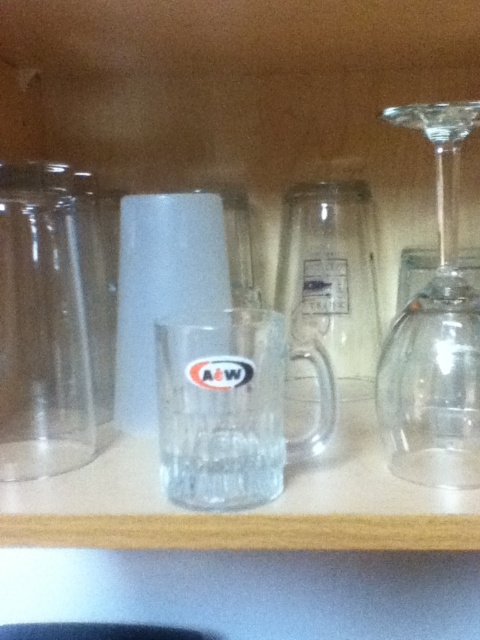
You are organizing the glassware on the wooden shelf and need to know the arrangement. Is the transparent glass vase at left located above or below the transparent glass wine glass at right?

The transparent glass vase at left is positioned under the transparent glass wine glass at right, so it is below it.

You need to choose between the transparent glass vase at left and the transparent glass wine glass at right for holding a bouquet of flowers. Which one is taller?

The transparent glass wine glass at right is taller than the transparent glass vase at left.